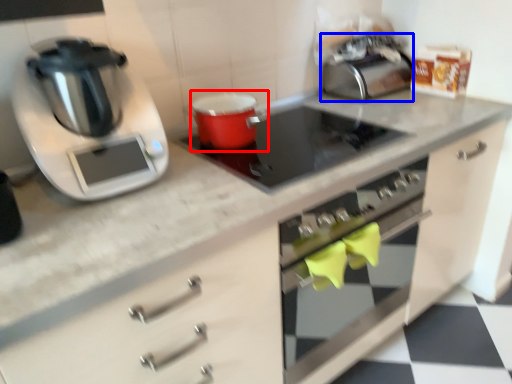
Question: Which object is further to the camera taking this photo, appliance (highlighted by a red box) or toaster (highlighted by a blue box)?

Choices:
 (A) appliance
 (B) toaster

Answer: (B)